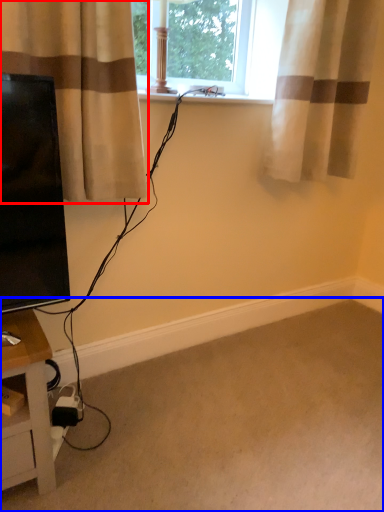
Question: Which object is closer to the camera taking this photo, curtain (highlighted by a red box) or plain (highlighted by a blue box)?

Choices:
 (A) curtain
 (B) plain

Answer: (B)